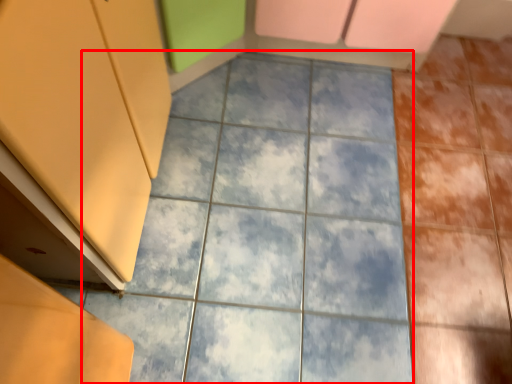
Question: In this image, where is ceramic tile (annotated by the red box) located relative to cabinetry?

Choices:
 (A) left
 (B) right

Answer: (B)